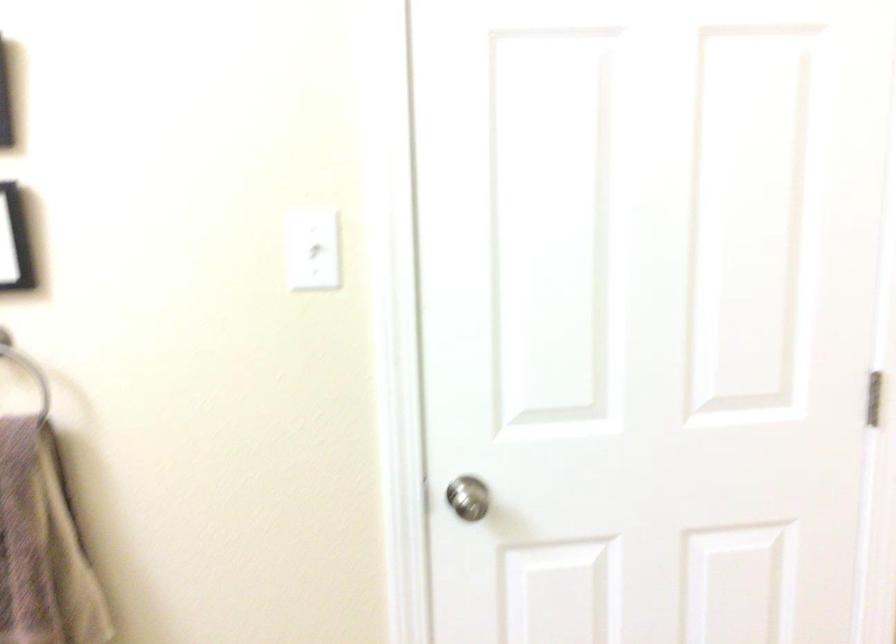
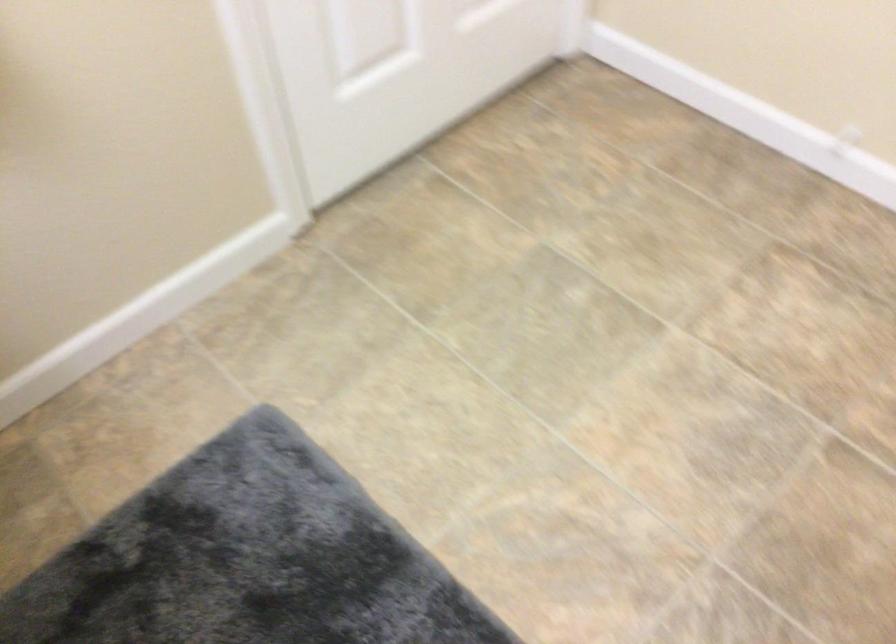
From the picture: The first image is from the beginning of the video and the second image is from the end. How did the camera likely rotate when shooting the video?

The camera rotated toward right-down.